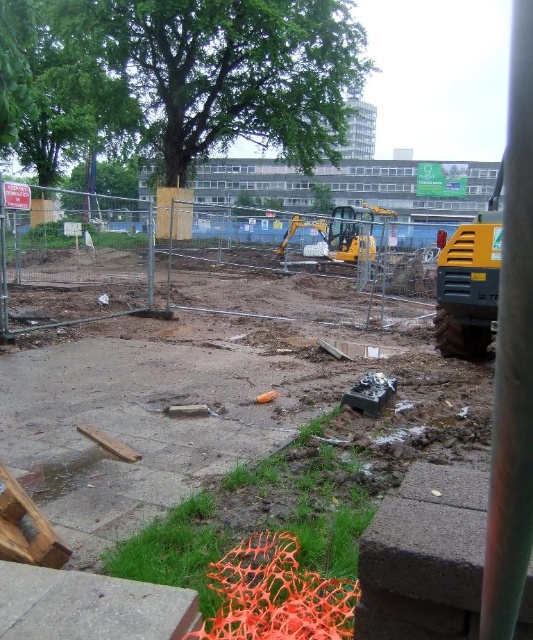
Can you confirm if green leafy tree at upper left is shorter than yellow rubber excavator at right?

No, green leafy tree at upper left is not shorter than yellow rubber excavator at right.

Between green leafy tree at upper left and yellow rubber excavator at right, which one is positioned higher?

green leafy tree at upper left is above.

Identify the location of green leafy tree at upper left. (180, 76).

This screenshot has width=533, height=640. What are the coordinates of `green leafy tree at upper left` in the screenshot? It's located at (180, 76).

Can you confirm if yellow metallic excavator at center is positioned to the right of green leafy tree at upper center?

Indeed, yellow metallic excavator at center is positioned on the right side of green leafy tree at upper center.

Looking at this image, can you confirm if yellow metallic excavator at center is positioned to the left of green leafy tree at upper center?

No, yellow metallic excavator at center is not to the left of green leafy tree at upper center.

Between point (295, 225) and point (78, 176), which one is positioned behind?

Positioned behind is point (78, 176).

Identify the location of yellow metallic excavator at center. Image resolution: width=533 pixels, height=640 pixels. (338, 236).

Which is in front, point (189, 81) or point (361, 228)?

Point (361, 228)

Is green leafy tree at upper left shorter than yellow metallic excavator at center?

In fact, green leafy tree at upper left may be taller than yellow metallic excavator at center.

Which is behind, point (303, 68) or point (329, 227)?

The point (303, 68) is more distant.

Where is `green leafy tree at upper left`? green leafy tree at upper left is located at coordinates (180, 76).